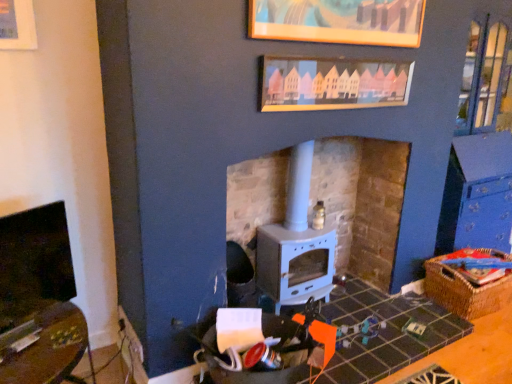
The image size is (512, 384). Identify the location of vacant area situated below matte black fireplace at left (from a real-world perspective). (39, 319).